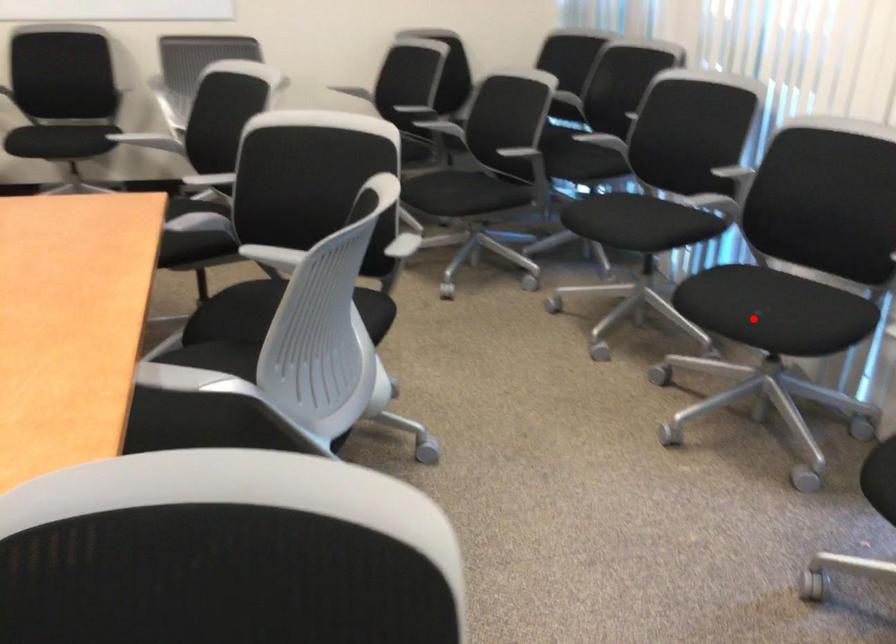
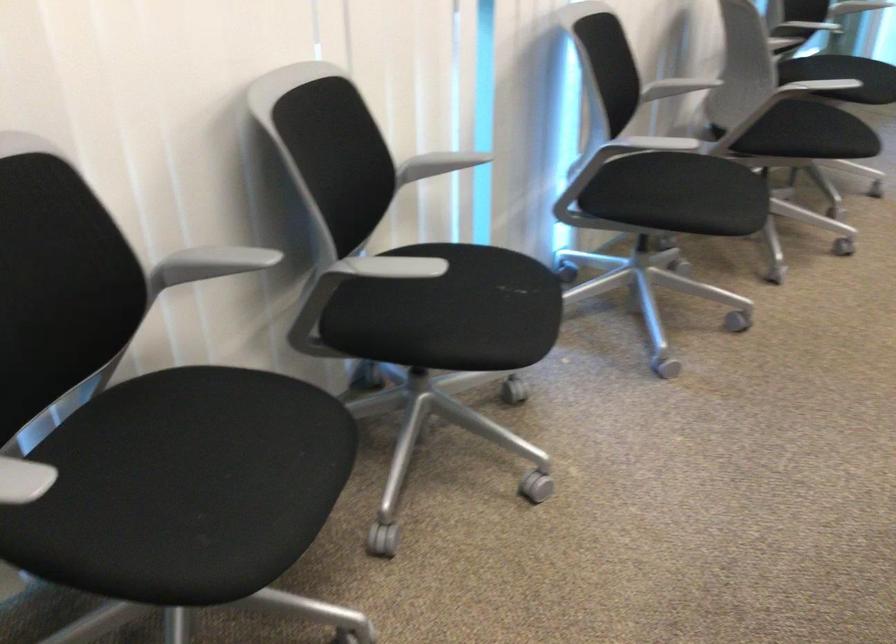
Locate, in the second image, the point that corresponds to the highlighted location in the first image.

(515, 287)